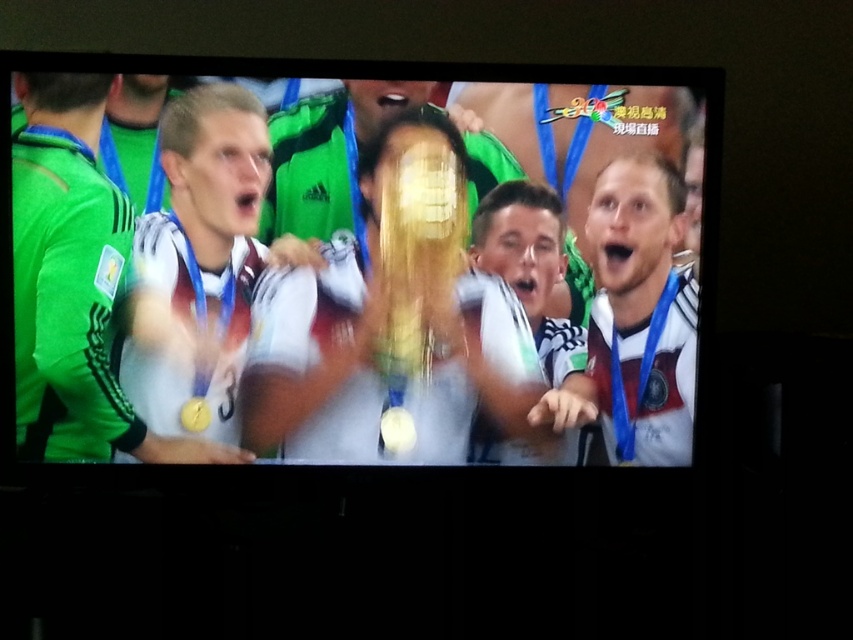
Question: Is white matte jersey at center thinner than gold shiny medal at center?

Choices:
 (A) yes
 (B) no

Answer: (B)

Question: Which of the following is the closest to the observer?

Choices:
 (A) (560, 269)
 (B) (26, 161)
 (C) (640, 435)
 (D) (315, 433)

Answer: (B)

Question: Is white matte jersey at center thinner than gold shiny medal at center?

Choices:
 (A) no
 (B) yes

Answer: (A)

Question: Among these points, which one is farthest from the camera?

Choices:
 (A) (90, 236)
 (B) (183, 406)

Answer: (B)

Question: Which of the following is the farthest from the observer?

Choices:
 (A) 679,221
 (B) 369,292
 (C) 223,358
 (D) 502,188

Answer: (A)

Question: Can you confirm if white matte jersey at right is positioned above white matte jersey at center?

Choices:
 (A) yes
 (B) no

Answer: (A)